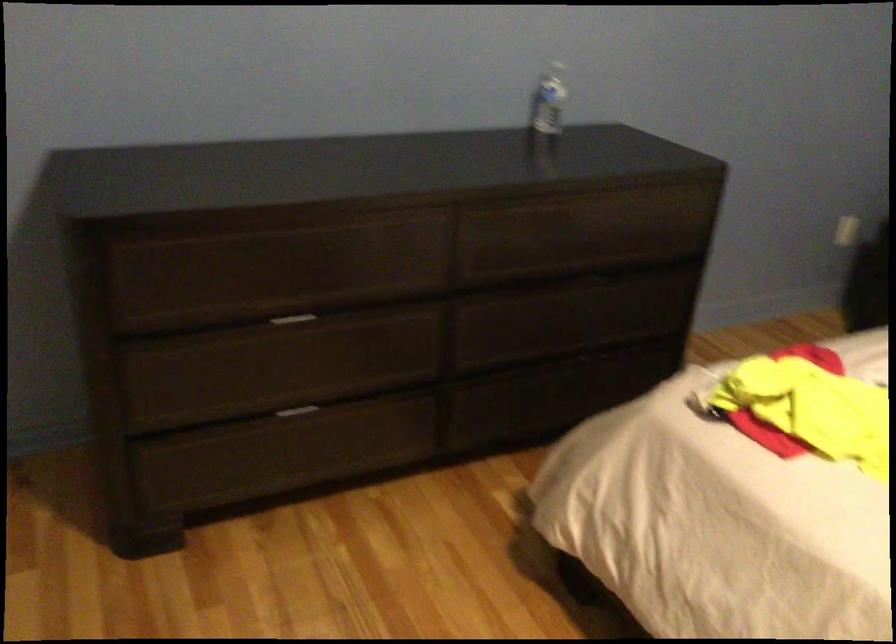
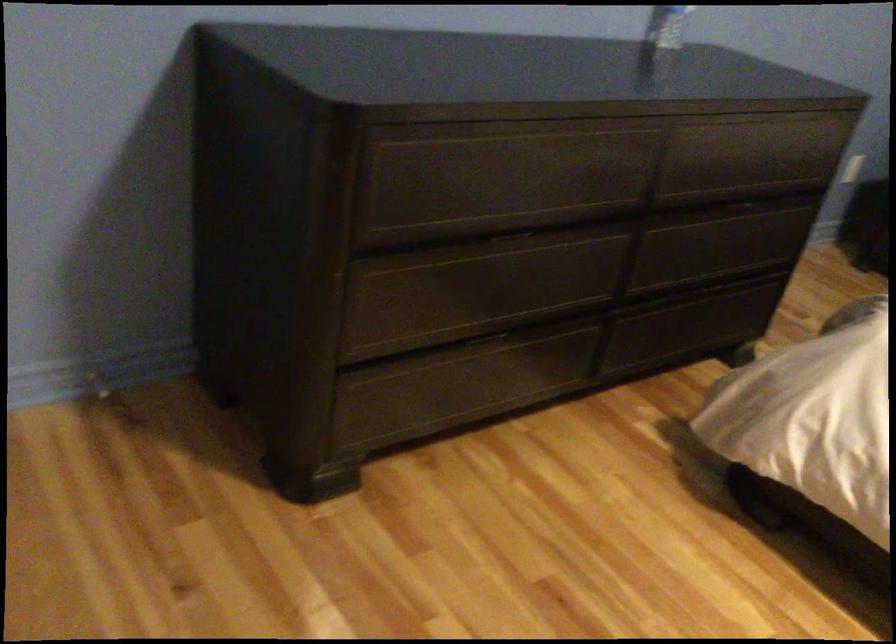
Question: The camera is either moving clockwise (left) or counter-clockwise (right) around the object. The first image is from the beginning of the video and the second image is from the end. Is the camera moving left or right when shooting the video?

Choices:
 (A) Left
 (B) Right

Answer: (A)